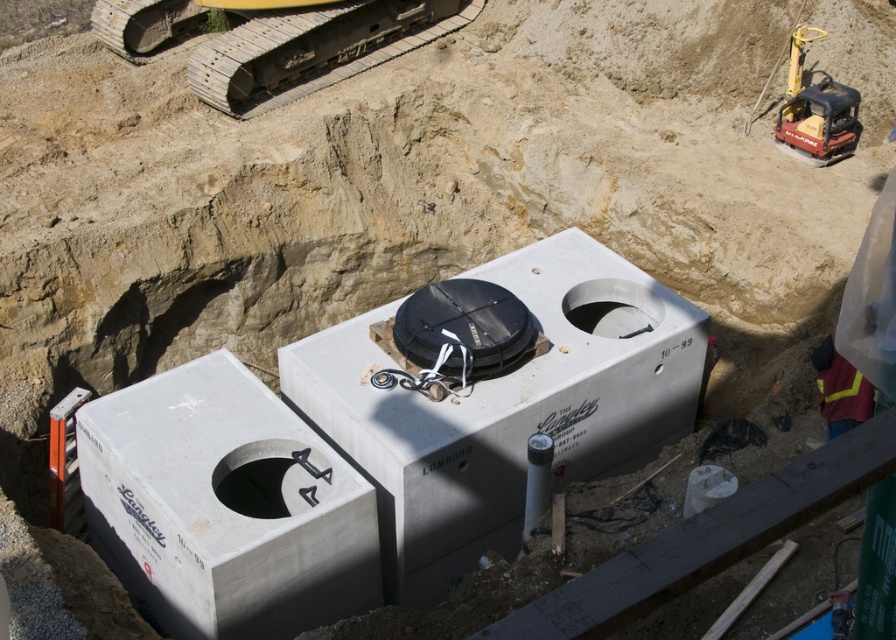
From the picture: Can you confirm if gray concrete water tank at center is thinner than smooth concrete hole at center?

Incorrect, gray concrete water tank at center's width is not less than smooth concrete hole at center's.

Can you confirm if gray concrete water tank at center is smaller than smooth concrete hole at center?

Incorrect, gray concrete water tank at center is not smaller in size than smooth concrete hole at center.

Between point (476, 484) and point (660, 300), which one is positioned in front?

Point (476, 484) is more forward.

What are the coordinates of `gray concrete water tank at center` in the screenshot? It's located at (x=497, y=412).

Who is more distant from viewer, [270,506] or [575,308]?

The point [575,308] is more distant.

Which of these two, black matte hole at center or smooth concrete hole at center, stands shorter?

smooth concrete hole at center is shorter.

Does point (265, 496) lie behind point (562, 300)?

No, it is not.

This screenshot has width=896, height=640. What are the coordinates of `black matte hole at center` in the screenshot? It's located at (270, 477).

Consider the image. Does gray metallic tracks at upper left have a larger size compared to smooth concrete hole at center?

Yes.

Is the position of gray metallic tracks at upper left less distant than that of smooth concrete hole at center?

No.

This screenshot has height=640, width=896. I want to click on gray metallic tracks at upper left, so click(x=313, y=49).